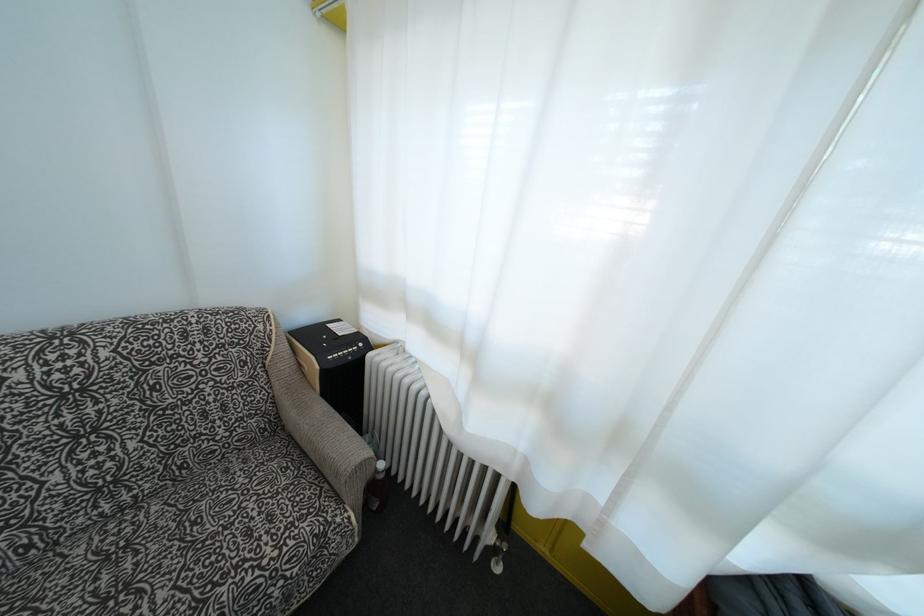
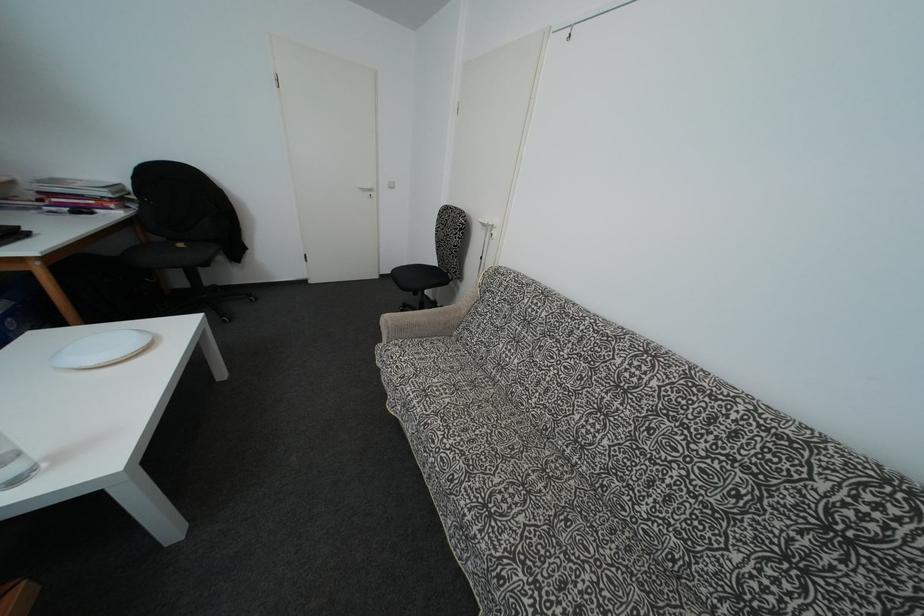
The first image is from the beginning of the video and the second image is from the end. How did the camera likely rotate when shooting the video?

The camera's rotation is toward left-down.